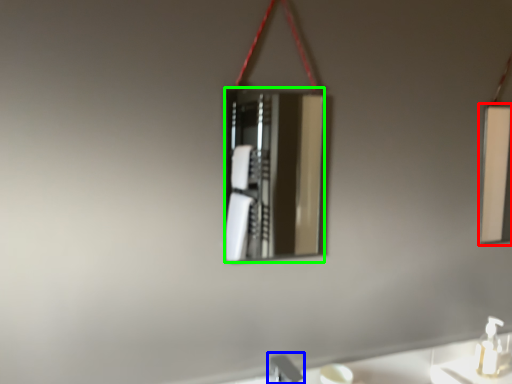
Question: Estimate the real-world distances between objects in this image. Which object is closer to mirror (highlighted by a red box), faucet (highlighted by a blue box) or mirror (highlighted by a green box)?

Choices:
 (A) faucet
 (B) mirror

Answer: (B)